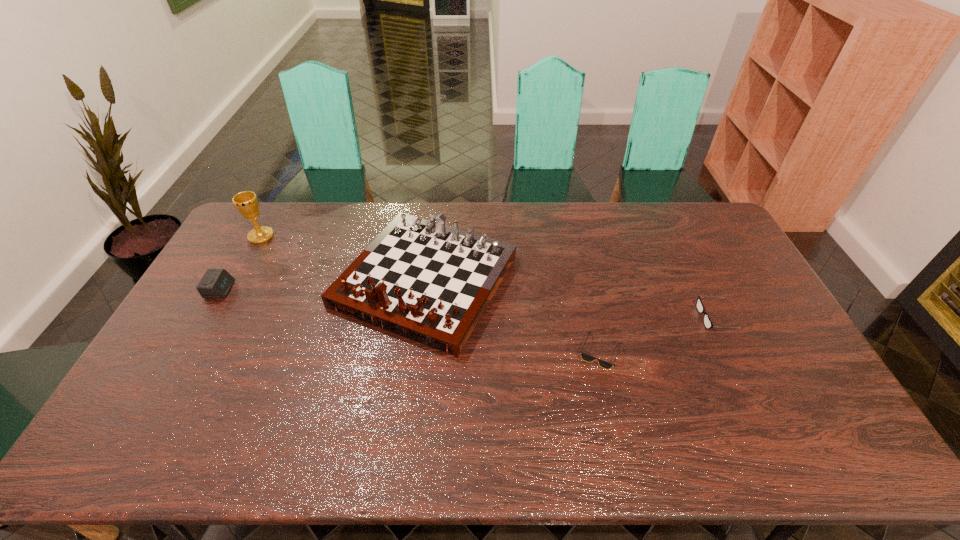
The height and width of the screenshot is (540, 960). What are the coordinates of `vacant space at the far edge of the desktop` in the screenshot? It's located at (411, 202).

The image size is (960, 540). I want to click on blank space at the near edge of the desktop, so click(228, 444).

In the image, there is a desktop. Where is `vacant area at the left edge`? The image size is (960, 540). vacant area at the left edge is located at coordinates (186, 327).

What are the coordinates of `vacant space at the far left corner of the desktop` in the screenshot? It's located at coord(279,234).

Image resolution: width=960 pixels, height=540 pixels. Find the location of `vacant space at the far right corner`. vacant space at the far right corner is located at coordinates (692, 208).

This screenshot has width=960, height=540. In order to click on empty space between the alarm clock and the third object from left to right in this screenshot , I will do `click(323, 285)`.

You are a GUI agent. You are given a task and a screenshot of the screen. Output one action in this format:
    pyautogui.click(x=<x>, y=<y>)
    Task: Click on the blank region between the spectacles and the sunglasses
    This screenshot has width=960, height=540.
    Given the screenshot: What is the action you would take?
    pyautogui.click(x=659, y=335)

I want to click on unoccupied position between the sunglasses and the third object from left to right, so click(513, 316).

Locate an element on the screen. The height and width of the screenshot is (540, 960). vacant area that lies between the rightmost object and the fourth object from left to right is located at coordinates (659, 335).

Identify the location of vacant space that is in between the alarm clock and the chalice. (241, 263).